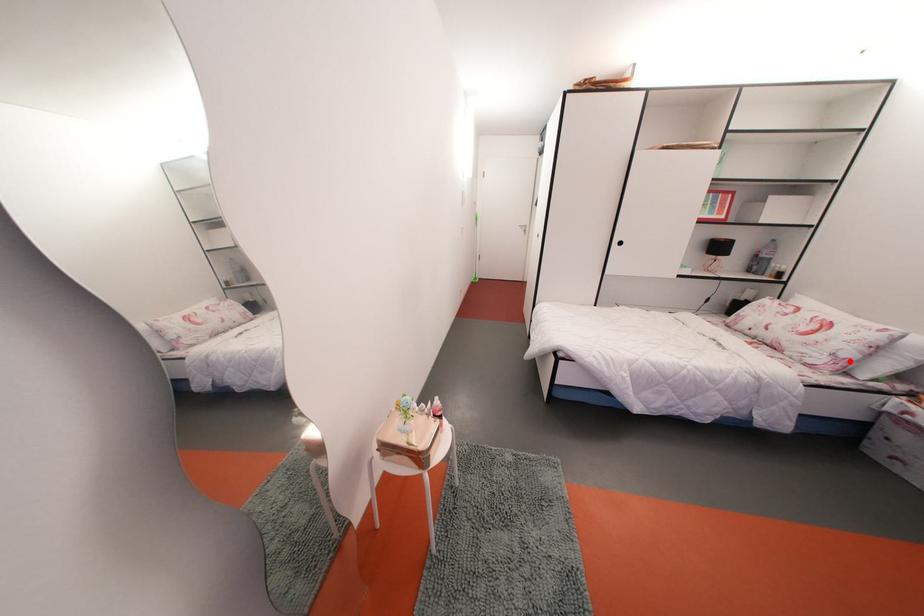
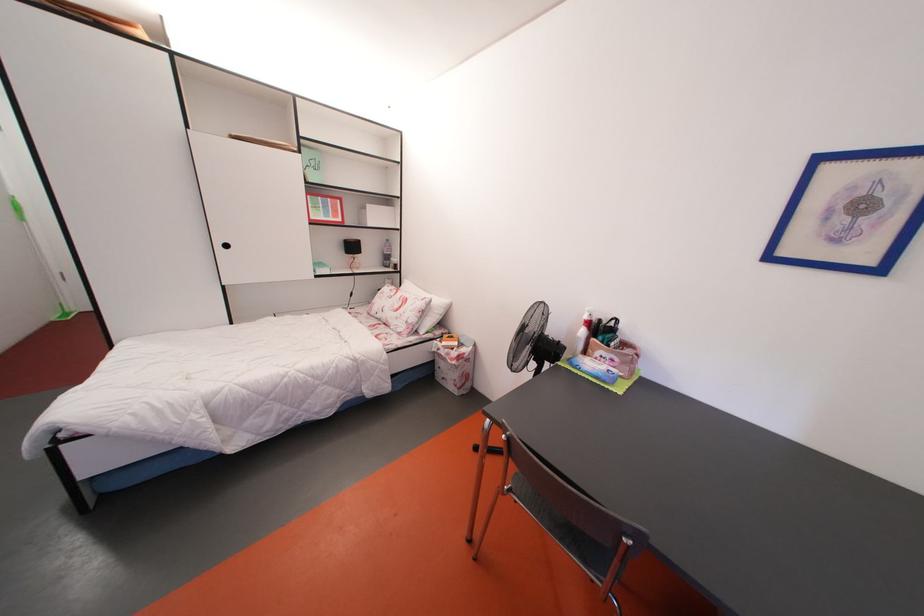
The point at the highlighted location is marked in the first image. Where is the corresponding point in the second image?

(417, 326)